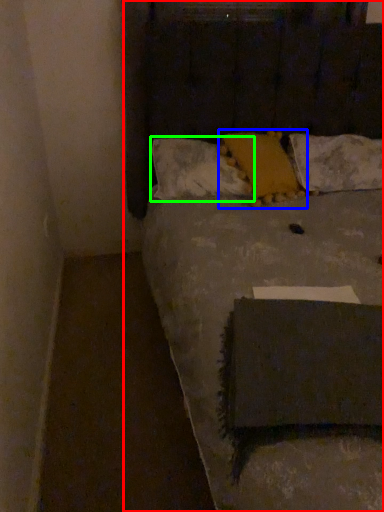
Question: Considering the real-world distances, which object is closest to bed (highlighted by a red box)? pillow (highlighted by a blue box) or pillow (highlighted by a green box).

Choices:
 (A) pillow
 (B) pillow

Answer: (B)